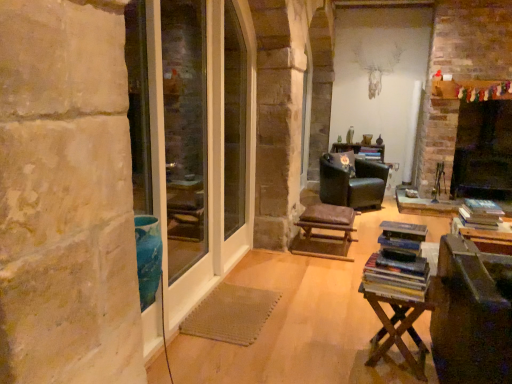
Where is `clear glass screen door at left, marked as the 1th screen door in a right-to-left arrangement`? clear glass screen door at left, marked as the 1th screen door in a right-to-left arrangement is located at coordinates (194, 138).

Image resolution: width=512 pixels, height=384 pixels. What do you see at coordinates (352, 181) in the screenshot?
I see `black leather chair at center` at bounding box center [352, 181].

This screenshot has width=512, height=384. What do you see at coordinates (327, 220) in the screenshot?
I see `brown leather stool at center` at bounding box center [327, 220].

Image resolution: width=512 pixels, height=384 pixels. Describe the element at coordinates (234, 121) in the screenshot. I see `clear glass window screen at center` at that location.

Locate an element on the screen. hardcover books at center right is located at coordinates (398, 263).

Is wooden table at lower right turned away from black matte fireplace at right?

No.

Can you tell me how much wooden table at lower right and black matte fireplace at right differ in facing direction?

The angle between the facing direction of wooden table at lower right and the facing direction of black matte fireplace at right is 176 degrees.

Between wooden table at lower right and black matte fireplace at right, which one has larger size?

black matte fireplace at right.

Based on the photo, considering the relative sizes of wooden table at lower right and black matte fireplace at right in the image provided, is wooden table at lower right thinner than black matte fireplace at right?

Yes.

Considering the sizes of clear glass window screen at center and wooden table at lower right in the image, is clear glass window screen at center taller or shorter than wooden table at lower right?

Considering their sizes, clear glass window screen at center has more height than wooden table at lower right.

Is clear glass window screen at center to the left or to the right of wooden table at lower right in the image?

clear glass window screen at center is to the left of wooden table at lower right.

From the image's perspective, is clear glass window screen at center over wooden table at lower right?

Indeed, from the image's perspective, clear glass window screen at center is shown above wooden table at lower right.

Is clear glass window screen at center positioned beyond the bounds of wooden table at lower right?

clear glass window screen at center is positioned outside wooden table at lower right.

Between wooden table at lower right and clear glass screen door at left, marked as the 1th screen door in a right-to-left arrangement, which one has more height?

clear glass screen door at left, marked as the 1th screen door in a right-to-left arrangement, is taller.

Is wooden table at lower right surrounding clear glass screen door at left, which is the 2th screen door in left-to-right order?

No, clear glass screen door at left, which is the 2th screen door in left-to-right order, is located outside of wooden table at lower right.

Relative to clear glass screen door at left, which is the 2th screen door in left-to-right order, is wooden table at lower right in front or behind?

wooden table at lower right is behind clear glass screen door at left, which is the 2th screen door in left-to-right order.

From the image's perspective, does wooden table at lower right appear lower than clear glass screen door at left, which is the 2th screen door in left-to-right order?

Yes, from the image's perspective, wooden table at lower right is below clear glass screen door at left, which is the 2th screen door in left-to-right order.

Is clear glass screen door at left, which is the 2th screen door in left-to-right order, oriented towards hardcover books at center right?

→ Yes, clear glass screen door at left, which is the 2th screen door in left-to-right order, is oriented towards hardcover books at center right.

Looking at the image, does clear glass screen door at left, marked as the 1th screen door in a right-to-left arrangement, seem bigger or smaller compared to hardcover books at center right?

In the image, clear glass screen door at left, marked as the 1th screen door in a right-to-left arrangement, appears to be larger than hardcover books at center right.

Do you think clear glass screen door at left, which is the 2th screen door in left-to-right order, is within hardcover books at center right, or outside of it?

clear glass screen door at left, which is the 2th screen door in left-to-right order, is not enclosed by hardcover books at center right.

Considering the positions of point (182, 43) and point (405, 290), is point (182, 43) closer or farther from the camera than point (405, 290)?

Point (182, 43) is positioned farther from the camera compared to point (405, 290).

Does clear glass door at left, the second screen door when ordered from right to left, touch hardcover books at center right?

No.

How many degrees apart are the facing directions of clear glass door at left, the second screen door when ordered from right to left, and hardcover books at center right?

The angle between the facing direction of clear glass door at left, the second screen door when ordered from right to left, and the facing direction of hardcover books at center right is 171 degrees.

Find the location of a particular element. the 2nd screen door counting from the left of the hardcover books at center right is located at coordinates (185, 131).

Could you tell me if clear glass door at left, the first screen door viewed from the left, is turned towards hardcover books at center right?

Yes, clear glass door at left, the first screen door viewed from the left, is facing hardcover books at center right.

Considering the relative sizes of brown leather stool at center and black leather chair at center in the image provided, is brown leather stool at center shorter than black leather chair at center?

Yes.

From a real-world perspective, is brown leather stool at center positioned under black leather chair at center based on gravity?

Yes, from a real-world perspective, brown leather stool at center is under black leather chair at center.

Consider the image. Is brown leather stool at center completely or partially outside of black leather chair at center?

Absolutely, brown leather stool at center is external to black leather chair at center.

Visually, is brown leather stool at center positioned to the left or to the right of black leather chair at center?

From the image, it's evident that brown leather stool at center is to the left of black leather chair at center.

Is clear glass screen door at left, marked as the 1th screen door in a right-to-left arrangement, situated inside clear glass window screen at center or outside?

clear glass screen door at left, marked as the 1th screen door in a right-to-left arrangement, lies outside clear glass window screen at center.

Is point (208, 149) farther from viewer compared to point (228, 51)?

No, it is not.

In order to click on window screen above the clear glass screen door at left, marked as the 1th screen door in a right-to-left arrangement (from a real-world perspective) in this screenshot , I will do `click(234, 121)`.

From the picture: Is clear glass screen door at left, which is the 2th screen door in left-to-right order, at the right side of clear glass window screen at center?

No, clear glass screen door at left, which is the 2th screen door in left-to-right order, is not to the right of clear glass window screen at center.

Where is `fireplace that appears above the wooden table at lower right (from the image's perspective)`? Image resolution: width=512 pixels, height=384 pixels. fireplace that appears above the wooden table at lower right (from the image's perspective) is located at coordinates (x=483, y=151).

This screenshot has width=512, height=384. Find the location of `table that appears on the right of clear glass window screen at center`. table that appears on the right of clear glass window screen at center is located at coordinates tap(395, 315).

From the image, which object appears to be nearer to clear glass door at left, the second screen door when ordered from right to left, brown leather stool at center or clear glass screen door at left, which is the 2th screen door in left-to-right order?

clear glass screen door at left, which is the 2th screen door in left-to-right order, is positioned closer to the anchor clear glass door at left, the second screen door when ordered from right to left.

Based on their spatial positions, is brown leather stool at center or black leather chair at center closer to clear glass screen door at left, marked as the 1th screen door in a right-to-left arrangement?

The object closer to clear glass screen door at left, marked as the 1th screen door in a right-to-left arrangement, is brown leather stool at center.

From the image, which object appears to be farther from black leather chair at center, black matte fireplace at right or clear glass screen door at left, which is the 2th screen door in left-to-right order?

The object further to black leather chair at center is clear glass screen door at left, which is the 2th screen door in left-to-right order.

Based on their spatial positions, is wooden table at lower right or hardcover books at center right further from black leather chair at center?

wooden table at lower right is further to black leather chair at center.

Which object lies nearer to the anchor point wooden table at lower right, brown leather stool at center or black matte fireplace at right?

Among the two, brown leather stool at center is located nearer to wooden table at lower right.

From the image, which object appears to be nearer to clear glass screen door at left, marked as the 1th screen door in a right-to-left arrangement, brown leather stool at center or hardcover books at center right?

The object closer to clear glass screen door at left, marked as the 1th screen door in a right-to-left arrangement, is brown leather stool at center.

Considering their positions, is hardcover books at center right positioned further to clear glass screen door at left, which is the 2th screen door in left-to-right order, than brown leather stool at center?

hardcover books at center right lies further to clear glass screen door at left, which is the 2th screen door in left-to-right order, than the other object.

Which object lies further to the anchor point clear glass screen door at left, which is the 2th screen door in left-to-right order, clear glass window screen at center or wooden table at lower right?

wooden table at lower right lies further to clear glass screen door at left, which is the 2th screen door in left-to-right order, than the other object.

Locate an element on the screen. This screenshot has height=384, width=512. book located between clear glass screen door at left, marked as the 1th screen door in a right-to-left arrangement, and clear glass window screen at center in the depth direction is located at coordinates (398, 263).

Locate an element on the screen. book that lies between clear glass window screen at center and wooden table at lower right from top to bottom is located at coordinates (398, 263).

The image size is (512, 384). Find the location of `window screen between clear glass door at left, the second screen door when ordered from right to left, and brown leather stool at center, along the z-axis`. window screen between clear glass door at left, the second screen door when ordered from right to left, and brown leather stool at center, along the z-axis is located at coordinates (234, 121).

Locate an element on the screen. The height and width of the screenshot is (384, 512). stool between hardcover books at center right and black leather chair at center along the z-axis is located at coordinates (327, 220).